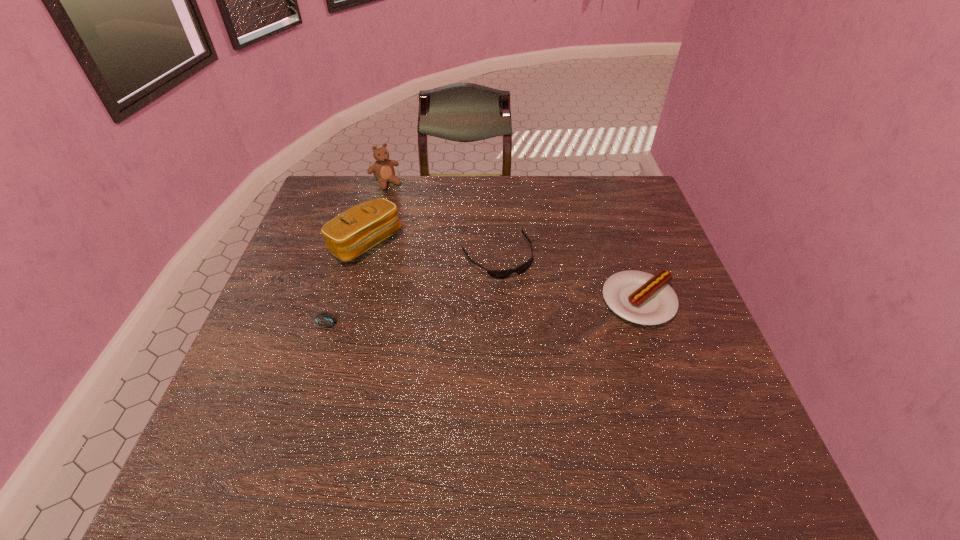
Locate an element on the screen. The image size is (960, 540). vacant space on the desktop that is between the mouse and the rightmost object and is positioned on the zipper side of the fourth shortest object is located at coordinates (455, 316).

What are the coordinates of `vacant space on the desktop that is between the mouse and the third tallest object and is positioned on the front-facing side of the tallest object` in the screenshot? It's located at (492, 314).

Locate an element on the screen. The width and height of the screenshot is (960, 540). vacant space on the desktop that is between the mouse and the rightmost object and is positioned on the front-facing side of the second object from right to left is located at coordinates (532, 310).